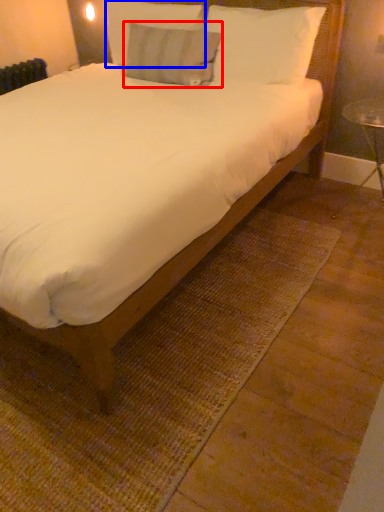
Question: Which object is further to the camera taking this photo, pillow (highlighted by a red box) or pillow (highlighted by a blue box)?

Choices:
 (A) pillow
 (B) pillow

Answer: (B)